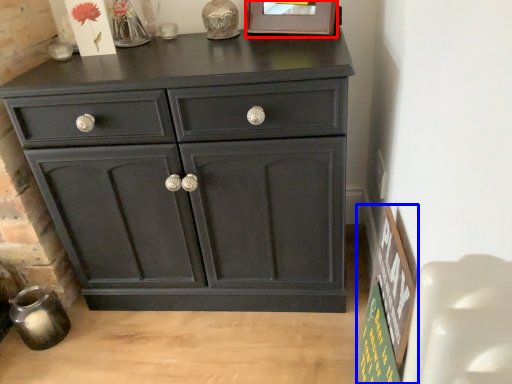
Question: Which object appears farthest to the camera in this image, picture frame (highlighted by a red box) or bulletin board (highlighted by a blue box)?

Choices:
 (A) picture frame
 (B) bulletin board

Answer: (A)